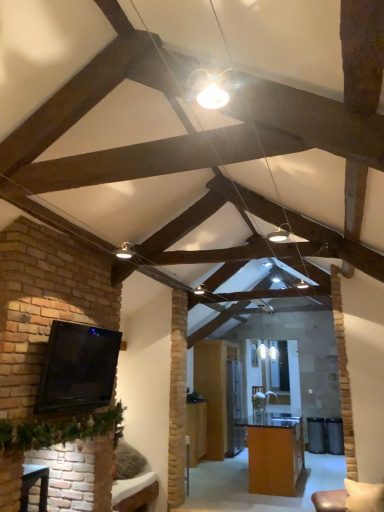
Question: Can you confirm if orange glossy table at center, marked as the 2th table in a left-to-right arrangement, is thinner than brick fireplace at lower left?

Choices:
 (A) no
 (B) yes

Answer: (A)

Question: Does orange glossy table at center, marked as the 2th table in a left-to-right arrangement, have a smaller size compared to brick fireplace at lower left?

Choices:
 (A) no
 (B) yes

Answer: (A)

Question: Would you say orange glossy table at center, marked as the 2th table in a left-to-right arrangement, contains brick fireplace at lower left?

Choices:
 (A) yes
 (B) no

Answer: (B)

Question: Considering the relative positions of orange glossy table at center, positioned as the 1th table in right-to-left order, and brick fireplace at lower left in the image provided, is orange glossy table at center, positioned as the 1th table in right-to-left order, to the left of brick fireplace at lower left from the viewer's perspective?

Choices:
 (A) yes
 (B) no

Answer: (B)

Question: From a real-world perspective, is orange glossy table at center, positioned as the 1th table in right-to-left order, physically above brick fireplace at lower left?

Choices:
 (A) no
 (B) yes

Answer: (A)

Question: Can you confirm if orange glossy table at center, marked as the 2th table in a left-to-right arrangement, is taller than brick fireplace at lower left?

Choices:
 (A) no
 (B) yes

Answer: (B)

Question: Does brick fireplace at lower left lie in front of black glossy tv at left?

Choices:
 (A) no
 (B) yes

Answer: (A)

Question: From a real-world perspective, is brick fireplace at lower left over black glossy tv at left?

Choices:
 (A) yes
 (B) no

Answer: (B)

Question: Is black glossy tv at left completely or partially inside brick fireplace at lower left?

Choices:
 (A) yes
 (B) no

Answer: (B)

Question: Would you say brick fireplace at lower left is a long distance from black glossy tv at left?

Choices:
 (A) no
 (B) yes

Answer: (A)

Question: Can you confirm if brick fireplace at lower left is smaller than black glossy tv at left?

Choices:
 (A) no
 (B) yes

Answer: (B)

Question: Can you confirm if brick fireplace at lower left is positioned to the right of black glossy tv at left?

Choices:
 (A) yes
 (B) no

Answer: (B)

Question: Considering the relative positions of wooden table at center, which is the first table from left to right, and orange glossy table at center, marked as the 2th table in a left-to-right arrangement, in the image provided, is wooden table at center, which is the first table from left to right, to the right of orange glossy table at center, marked as the 2th table in a left-to-right arrangement, from the viewer's perspective?

Choices:
 (A) yes
 (B) no

Answer: (B)